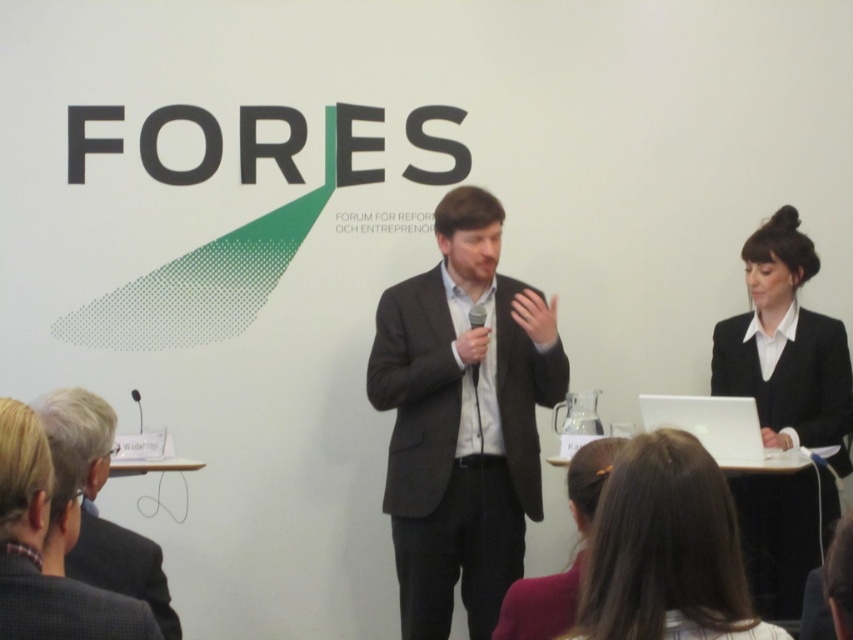
You are attending the conference and notice two points marked in the image. The first point is at coordinates point [48,616] and the second is at point [521,637]. Which point is closer to you as an attendee sitting in the audience?

Point [48,616] is in front of point [521,637], so it is closer to you as an attendee sitting in the audience.

You are standing in the conference room and want to move to the point marked as point (419, 362). If you take a step forward of 1 meter, how far will you be from the point?

The distance between you and point (419, 362) is 3.22 meters. After taking a 1 meter step forward, you will be 2.22 meters away from the point.

You are attending a conference and need to locate the speaker. Based on the coordinates provided, where is the dark gray suit at center positioned in the image?

The dark gray suit at center is positioned at coordinates point (462, 419).